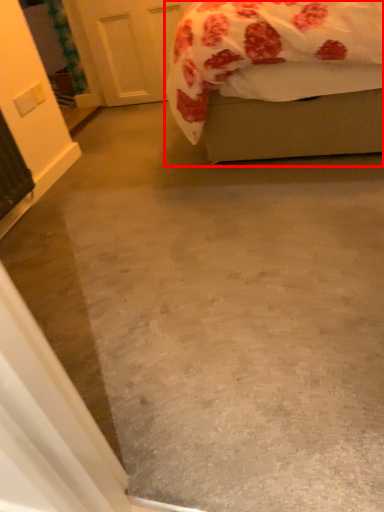
Question: Where is bed (annotated by the red box) located in relation to door in the image?

Choices:
 (A) left
 (B) right

Answer: (B)